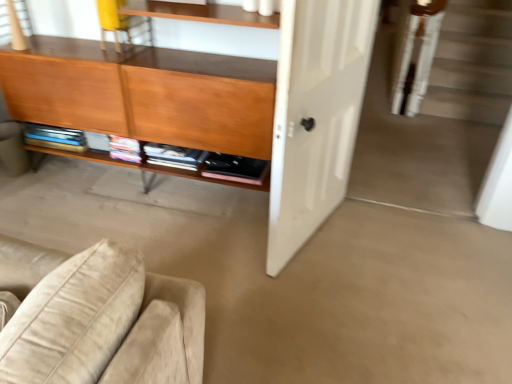
Question: From the image's perspective, is white matte door at center positioned above or below matte wood cabinet at left?

Choices:
 (A) below
 (B) above

Answer: (A)

Question: In terms of size, does white matte door at center appear bigger or smaller than matte wood cabinet at left?

Choices:
 (A) big
 (B) small

Answer: (B)

Question: Which object is the farthest from the white matte door at center?

Choices:
 (A) matte wood cabinet at left
 (B) yellow fabric chair at upper left
 (C) clear glass window at upper left

Answer: (C)

Question: Considering the real-world distances, which object is farthest from the matte wood cabinet at left?

Choices:
 (A) yellow fabric chair at upper left
 (B) clear glass window at upper left
 (C) white matte door at center

Answer: (B)